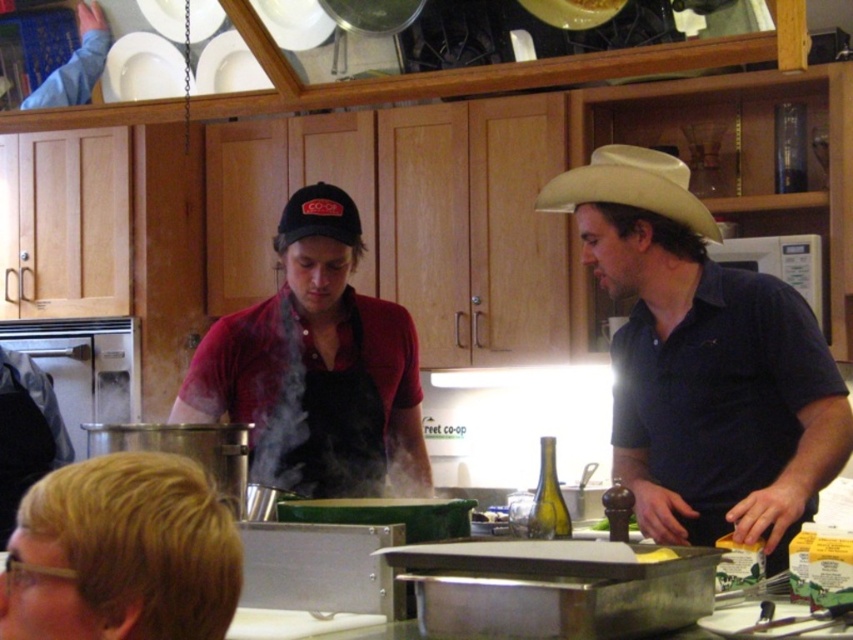
Question: From the image, what is the correct spatial relationship of beige felt cowboy hat at upper right in relation to white matte plate at upper left?

Choices:
 (A) left
 (B) right

Answer: (B)

Question: Estimate the real-world distances between objects in this image. Which object is farther from the dark blue shirt at center?

Choices:
 (A) beige felt cowboy hat at upper right
 (B) white matte plate at upper left

Answer: (B)

Question: Is dark blue shirt at center to the right of black fabric baseball cap at center from the viewer's perspective?

Choices:
 (A) no
 (B) yes

Answer: (B)

Question: Can you confirm if beige felt cowboy hat at upper right is positioned below black fabric baseball cap at center?

Choices:
 (A) no
 (B) yes

Answer: (A)

Question: Among these objects, which one is nearest to the camera?

Choices:
 (A) black fabric baseball cap at center
 (B) dark blue shirt at center
 (C) white matte plate at upper left

Answer: (B)

Question: Which point is closer to the camera?

Choices:
 (A) (573, 180)
 (B) (584, 170)
 (C) (160, 44)

Answer: (B)